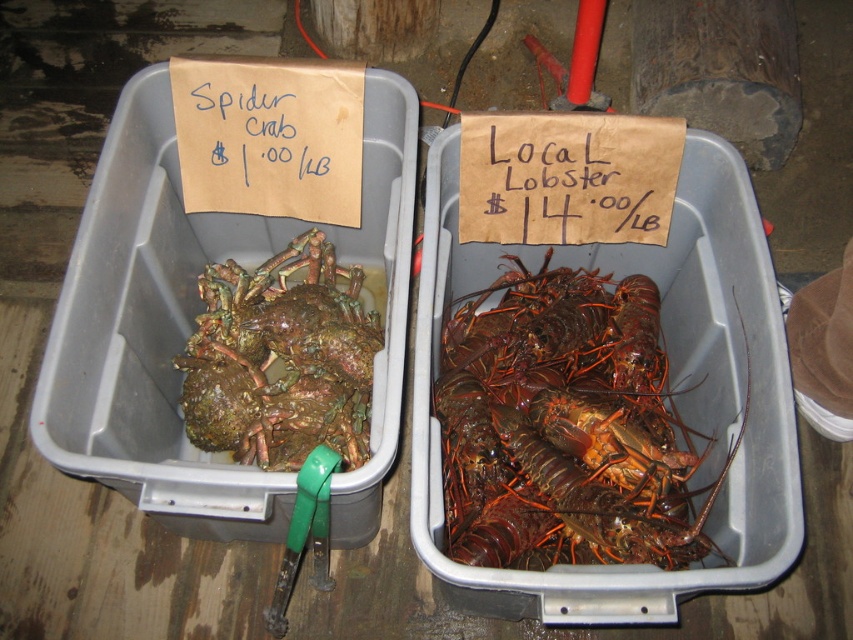
Question: Which of the following is the closest to the observer?

Choices:
 (A) greenish-brown crustacean at center-left
 (B) shiny orange lobster at right

Answer: (B)

Question: Does shiny orange lobster at right lie behind greenish-brown crustacean at center-left?

Choices:
 (A) yes
 (B) no

Answer: (B)

Question: Can you confirm if shiny orange lobster at right is wider than greenish-brown crustacean at center-left?

Choices:
 (A) no
 (B) yes

Answer: (B)

Question: Which point appears farthest from the camera in this image?

Choices:
 (A) (280, 310)
 (B) (498, 544)

Answer: (A)

Question: Does shiny orange lobster at right appear under greenish-brown crustacean at center-left?

Choices:
 (A) yes
 (B) no

Answer: (A)

Question: Which of the following is the farthest from the observer?

Choices:
 (A) (555, 442)
 (B) (196, 422)

Answer: (B)